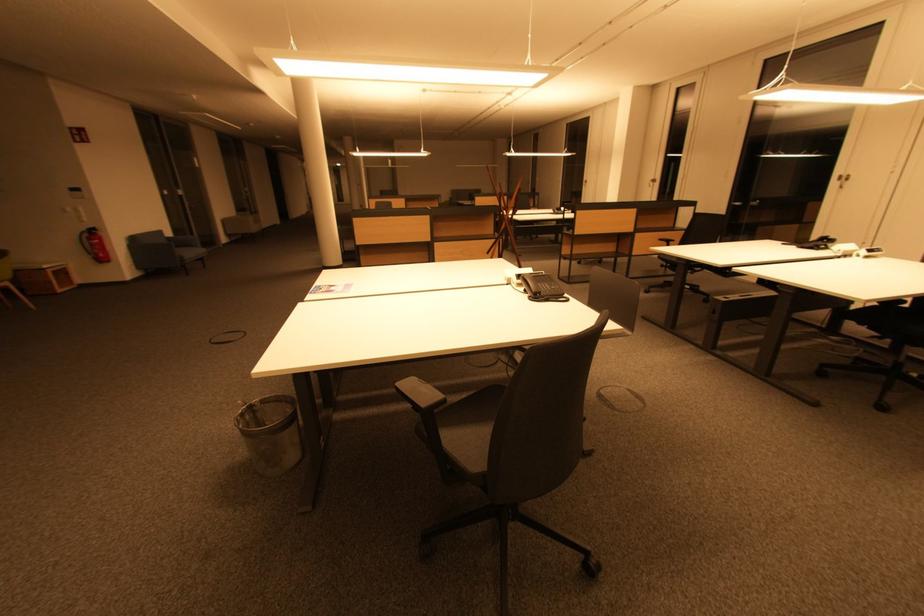
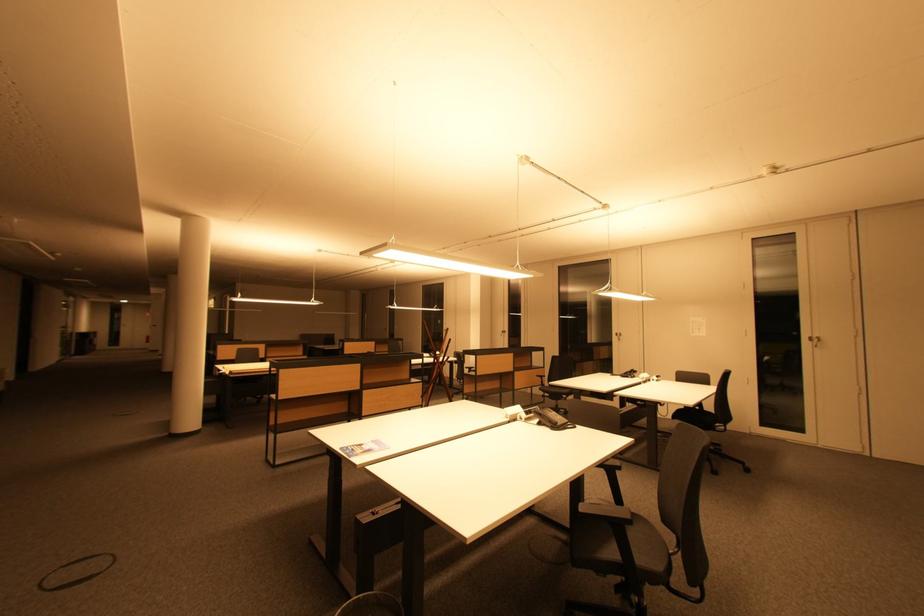
Find the pixel in the second image that matches [824,246] in the first image.

(635, 376)